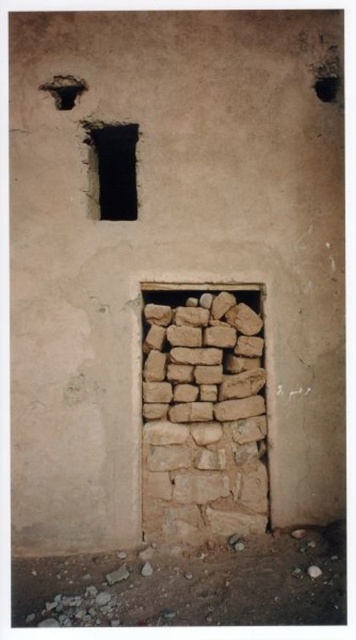
Question: From the image, what is the correct spatial relationship of black stone window at upper center in relation to smooth dark hole at upper right?

Choices:
 (A) below
 (B) above

Answer: (A)

Question: Which of the following is the farthest from the observer?

Choices:
 (A) black stone window at upper center
 (B) smooth dark hole at upper right

Answer: (B)

Question: Does black stone window at upper center have a lesser width compared to smooth dark hole at upper right?

Choices:
 (A) no
 (B) yes

Answer: (A)

Question: Is black stone window at upper center smaller than smooth dark hole at upper right?

Choices:
 (A) yes
 (B) no

Answer: (B)

Question: Among these objects, which one is farthest from the camera?

Choices:
 (A) black stone window at upper center
 (B) smooth dark hole at upper right

Answer: (B)

Question: Among these objects, which one is farthest from the camera?

Choices:
 (A) smooth dark hole at upper right
 (B) black stone window at upper center

Answer: (A)